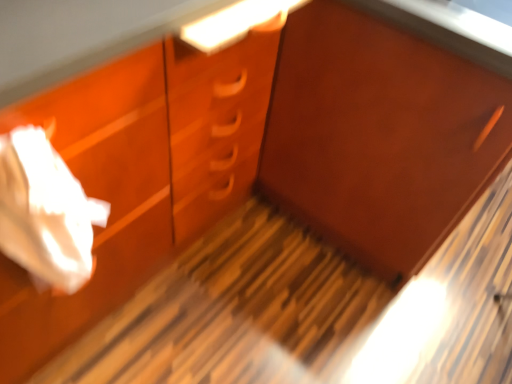
Question: Considering their positions, is matte wood cabinet at center located in front of or behind white paper at left?

Choices:
 (A) behind
 (B) front

Answer: (A)

Question: In terms of size, does matte wood cabinet at center appear bigger or smaller than white paper at left?

Choices:
 (A) small
 (B) big

Answer: (B)

Question: From the image's perspective, is matte wood cabinet at center positioned above or below white paper at left?

Choices:
 (A) above
 (B) below

Answer: (A)

Question: Relative to matte wood cabinet at center, is white paper at left in front or behind?

Choices:
 (A) front
 (B) behind

Answer: (A)

Question: In terms of width, does white paper at left look wider or thinner when compared to matte wood cabinet at center?

Choices:
 (A) thin
 (B) wide

Answer: (A)

Question: Would you say white paper at left is inside or outside matte wood cabinet at center?

Choices:
 (A) outside
 (B) inside

Answer: (A)

Question: Is white paper at left taller or shorter than matte wood cabinet at center?

Choices:
 (A) tall
 (B) short

Answer: (B)